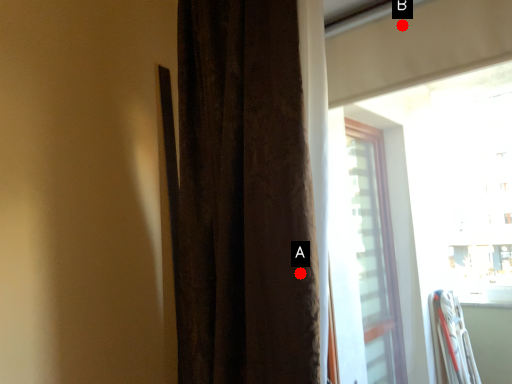
Question: Two points are circled on the image, labeled by A and B beside each circle. Which point is closer to the camera?

Choices:
 (A) A is closer
 (B) B is closer

Answer: (A)